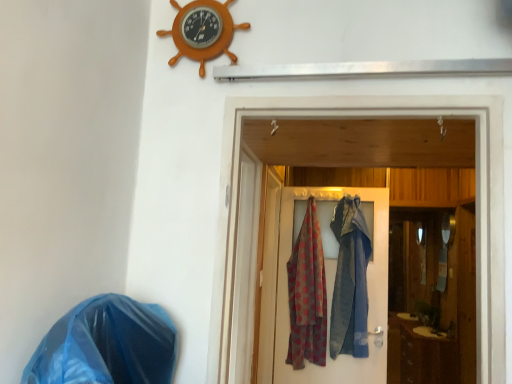
Question: From a real-world perspective, is polka dot fabric at center above or below wooden door at center, which is the 2th door in back-to-front order?

Choices:
 (A) above
 (B) below

Answer: (B)

Question: Is polka dot fabric at center to the left or to the right of wooden door at center, the 1th door in the front-to-back sequence, in the image?

Choices:
 (A) right
 (B) left

Answer: (A)

Question: Estimate the real-world distances between objects in this image. Which object is farther from the wooden door at center, the 1th door in the front-to-back sequence?

Choices:
 (A) blue plastic bag at lower left
 (B) orange wood ship wheel at upper center
 (C) polka dot fabric at center
 (D) polka dot fabric at center, positioned as the first door in back-to-front order

Answer: (D)

Question: Which of these objects is positioned closest to the blue plastic bag at lower left?

Choices:
 (A) polka dot fabric at center, positioned as the first door in back-to-front order
 (B) wooden door at center, the 1th door in the front-to-back sequence
 (C) polka dot fabric at center
 (D) orange wood ship wheel at upper center

Answer: (B)